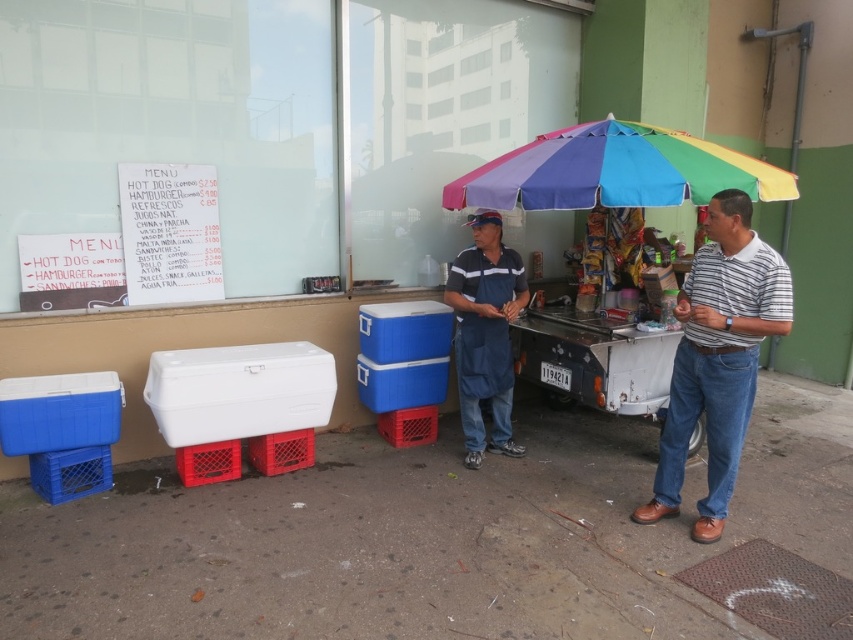
Looking at this image, does striped cotton polo shirt at right appear under rainbow fabric umbrella at upper right?

Yes.

Is striped cotton polo shirt at right to the left of rainbow fabric umbrella at upper right from the viewer's perspective?

Incorrect, striped cotton polo shirt at right is not on the left side of rainbow fabric umbrella at upper right.

The image size is (853, 640). What do you see at coordinates (718, 356) in the screenshot?
I see `striped cotton polo shirt at right` at bounding box center [718, 356].

At what (x,y) coordinates should I click in order to perform the action: click on striped cotton polo shirt at right. Please return your answer as a coordinate pair (x, y). This screenshot has height=640, width=853. Looking at the image, I should click on (718, 356).

Which is more to the right, rainbow fabric umbrella at upper right or blue fabric shirt at center?

rainbow fabric umbrella at upper right is more to the right.

Who is more distant from viewer, [785,195] or [511,275]?

Point [511,275]

Is point (585, 179) farther from camera compared to point (465, 324)?

No, it is not.

Identify the location of rainbow fabric umbrella at upper right. click(614, 172).

Can you confirm if striped cotton polo shirt at right is positioned to the left of blue fabric shirt at center?

Incorrect, striped cotton polo shirt at right is not on the left side of blue fabric shirt at center.

Which is behind, point (717, 349) or point (463, 321)?

Positioned behind is point (463, 321).

Does point (697, 269) come in front of point (451, 294)?

Yes, it is.

Image resolution: width=853 pixels, height=640 pixels. I want to click on striped cotton polo shirt at right, so click(718, 356).